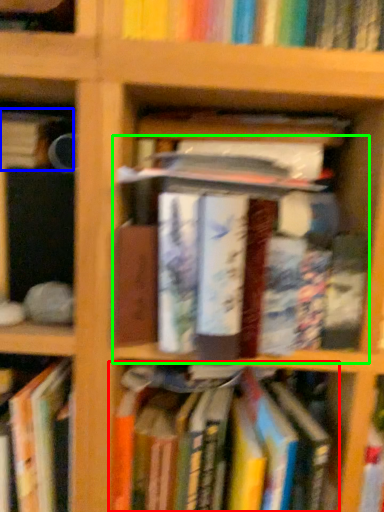
Question: Considering the real-world distances, which object is closest to book (highlighted by a red box)? book (highlighted by a blue box) or book (highlighted by a green box).

Choices:
 (A) book
 (B) book

Answer: (B)